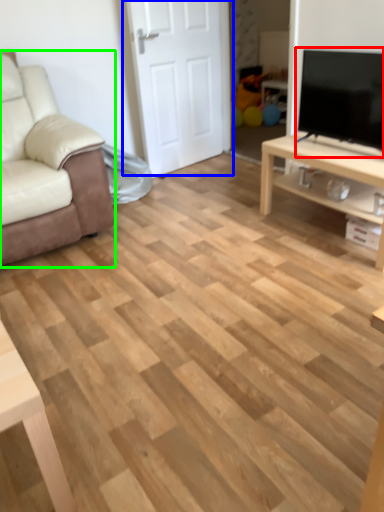
Question: Based on their relative distances, which object is nearer to television (highlighted by a red box)? Choose from door (highlighted by a blue box) and chair (highlighted by a green box).

Choices:
 (A) door
 (B) chair

Answer: (A)